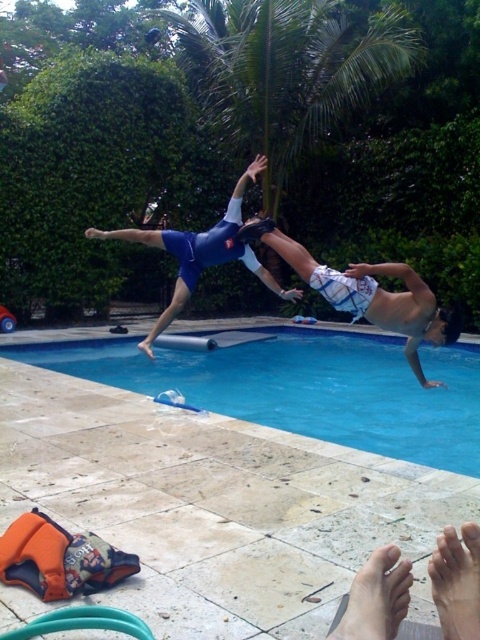
Question: Which object is farther from the camera taking this photo?

Choices:
 (A) blue matte swimsuit at center
 (B) white cotton shorts at center

Answer: (A)

Question: Which object is farther from the camera taking this photo?

Choices:
 (A) blue matte swimsuit at center
 (B) white cotton shorts at center
 (C) blue smooth water at center

Answer: (C)

Question: Does white cotton shorts at center appear under blue matte swimsuit at center?

Choices:
 (A) yes
 (B) no

Answer: (A)

Question: Can you confirm if blue smooth water at center is smaller than blue matte swimsuit at center?

Choices:
 (A) no
 (B) yes

Answer: (B)

Question: Which point is closer to the camera?

Choices:
 (A) (200, 237)
 (B) (76, 349)
 (C) (285, 241)

Answer: (C)

Question: Can you confirm if blue smooth water at center is wider than blue matte swimsuit at center?

Choices:
 (A) no
 (B) yes

Answer: (A)